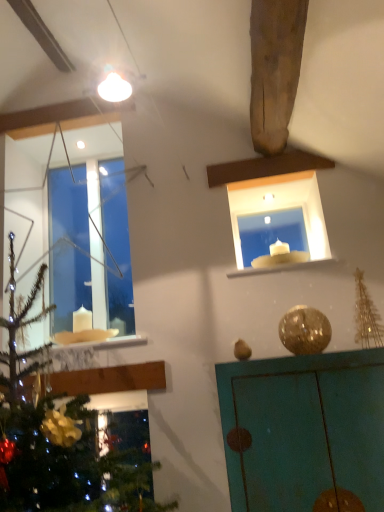
The image size is (384, 512). What do you see at coordinates (271, 233) in the screenshot?
I see `white glass candle at upper center` at bounding box center [271, 233].

At what (x,y) coordinates should I click in order to perform the action: click on white marble window sill at upper center. Please return your answer as a coordinate pair (x, y). Image resolution: width=384 pixels, height=512 pixels. Looking at the image, I should click on (280, 267).

What do you see at coordinates (280, 267) in the screenshot?
I see `white marble window sill at upper center` at bounding box center [280, 267].

Find the location of a particular element. Image resolution: width=384 pixels, height=512 pixels. transparent glass window at upper left is located at coordinates (87, 230).

Can you confirm if teal painted cabinet at upper right is bigger than white marble window sill at upper center?

Yes, teal painted cabinet at upper right is bigger than white marble window sill at upper center.

Could white marble window sill at upper center be considered to be inside teal painted cabinet at upper right?

No.

Are teal painted cabinet at upper right and white marble window sill at upper center located far from each other?

No, teal painted cabinet at upper right is not far from white marble window sill at upper center.

The image size is (384, 512). In order to click on furniture on the right of white marble window sill at upper center in this screenshot , I will do `click(304, 429)`.

From a real-world perspective, is transparent glass window at upper left physically located above or below teal painted cabinet at upper right?

transparent glass window at upper left is situated higher than teal painted cabinet at upper right in the real world.

Is point (121, 161) more distant than point (276, 478)?

Yes, it is.

Image resolution: width=384 pixels, height=512 pixels. I want to click on window on the left of teal painted cabinet at upper right, so click(87, 230).

How much distance is there between transparent glass window at upper left and teal painted cabinet at upper right?

transparent glass window at upper left is 4.74 feet from teal painted cabinet at upper right.

How many degrees apart are the facing directions of white glass candle at upper center and transparent glass window at upper left?

Result: The angle between the facing direction of white glass candle at upper center and the facing direction of transparent glass window at upper left is 0.00155 degrees.

From a real-world perspective, between white glass candle at upper center and transparent glass window at upper left, who is vertically higher?

transparent glass window at upper left.

Which is farther, (251, 233) or (98, 298)?

The point (251, 233) is farther.

From the image's perspective, which is above, white glass candle at upper center or transparent glass window at upper left?

transparent glass window at upper left.

Based on the photo, is white marble window sill at upper center located within transparent glass window at upper left?

No, white marble window sill at upper center is located outside of transparent glass window at upper left.

Could you tell me if transparent glass window at upper left is facing white marble window sill at upper center?

No, transparent glass window at upper left is not aimed at white marble window sill at upper center.

In the scene shown: Between transparent glass window at upper left and white marble window sill at upper center, which one has smaller width?

With smaller width is transparent glass window at upper left.

From the picture: Who is shorter, white marble window sill at upper center or white glass candle at upper center?

With less height is white marble window sill at upper center.

Can you confirm if white marble window sill at upper center is wider than white glass candle at upper center?

Yes, white marble window sill at upper center is wider than white glass candle at upper center.

Which object is more forward, white marble window sill at upper center or white glass candle at upper center?

white marble window sill at upper center.

At what (x,y) coordinates should I click in order to perform the action: click on window frame above the white marble window sill at upper center (from the image's perspective). Please return your answer as a coordinate pair (x, y). This screenshot has height=512, width=384. Looking at the image, I should click on (271, 233).

Consider the image. From the image's perspective, which object appears higher, teal painted cabinet at upper right or white glass candle at upper center?

white glass candle at upper center.

Between point (373, 362) and point (255, 231), which one is positioned behind?

The point (255, 231) is behind.

Considering the relative sizes of teal painted cabinet at upper right and white glass candle at upper center in the image provided, is teal painted cabinet at upper right bigger than white glass candle at upper center?

Yes, teal painted cabinet at upper right is bigger than white glass candle at upper center.

Is teal painted cabinet at upper right oriented away from white glass candle at upper center?

teal painted cabinet at upper right is not turned away from white glass candle at upper center.

From the image's perspective, which is above, white marble window sill at upper center or transparent glass window at upper left?

transparent glass window at upper left appears higher in the image.

In the image, there is a transparent glass window at upper left. Identify the location of window sill below it (from a real-world perspective). (280, 267).

Is white marble window sill at upper center facing away from transparent glass window at upper left?

No, transparent glass window at upper left is not at the back of white marble window sill at upper center.

Find the location of a particular element. The height and width of the screenshot is (512, 384). furniture directly beneath the white marble window sill at upper center (from a real-world perspective) is located at coordinates (304, 429).

Identify the location of furniture that is below the transparent glass window at upper left (from the image's perspective). The image size is (384, 512). (304, 429).

Based on their spatial positions, is white marble window sill at upper center or transparent glass window at upper left further from teal painted cabinet at upper right?

Based on the image, transparent glass window at upper left appears to be further to teal painted cabinet at upper right.

Based on their spatial positions, is white glass candle at upper center or transparent glass window at upper left further from teal painted cabinet at upper right?

Among the two, transparent glass window at upper left is located further to teal painted cabinet at upper right.

Based on their spatial positions, is white marble window sill at upper center or white glass candle at upper center further from transparent glass window at upper left?

white marble window sill at upper center is further to transparent glass window at upper left.

When comparing their distances from transparent glass window at upper left, does teal painted cabinet at upper right or white marble window sill at upper center seem closer?

The object closer to transparent glass window at upper left is white marble window sill at upper center.

Looking at this image, which object lies further to the anchor point white marble window sill at upper center, transparent glass window at upper left or white glass candle at upper center?

transparent glass window at upper left is further to white marble window sill at upper center.

Based on their spatial positions, is white glass candle at upper center or teal painted cabinet at upper right closer to white marble window sill at upper center?

Among the two, white glass candle at upper center is located nearer to white marble window sill at upper center.

Looking at the image, which one is located further to transparent glass window at upper left, white glass candle at upper center or white marble window sill at upper center?

Based on the image, white marble window sill at upper center appears to be further to transparent glass window at upper left.

Based on their spatial positions, is teal painted cabinet at upper right or transparent glass window at upper left closer to white marble window sill at upper center?

Based on the image, teal painted cabinet at upper right appears to be nearer to white marble window sill at upper center.

This screenshot has width=384, height=512. Identify the location of window sill between teal painted cabinet at upper right and white glass candle at upper center from front to back. (280, 267).

Identify the location of window sill situated between transparent glass window at upper left and teal painted cabinet at upper right from left to right. (280, 267).

The height and width of the screenshot is (512, 384). Identify the location of furniture between transparent glass window at upper left and white glass candle at upper center in the horizontal direction. (304, 429).

Locate an element on the screen. This screenshot has width=384, height=512. window sill between transparent glass window at upper left and white glass candle at upper center from left to right is located at coordinates (280, 267).